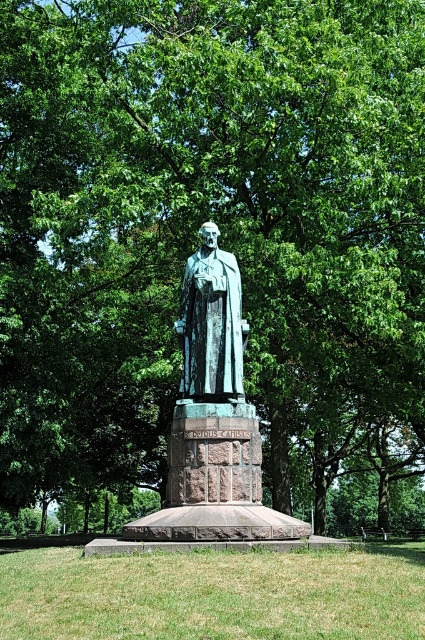
You are a gardener who wants to mow the green grass at center. Considering the height of the bronze statue at center, will the lawnmower be able to pass under it?

The green grass at center is not as tall as bronze statue at center, so the lawnmower can pass under the bronze statue at center since the grass is shorter than the statue.

You are planning to place a new bench in the park. The bench is 2 meters wide. You see the green grass at center and the bronze statue at center. Which area can accommodate the bench without overlapping the statue?

The green grass at center has a larger width than the bronze statue at center, so placing the bench on the green grass at center would accommodate the bench without overlapping the statue.